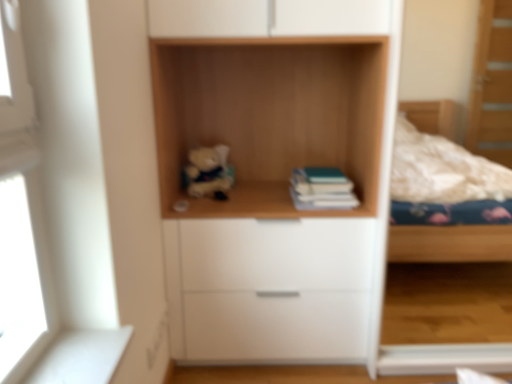
Measure the distance between white matte drawer at center and camera.

white matte drawer at center is 1.60 meters from camera.

The image size is (512, 384). Describe the element at coordinates (208, 172) in the screenshot. I see `soft plush bear at center` at that location.

What do you see at coordinates (270, 117) in the screenshot?
I see `wooden shelf at center` at bounding box center [270, 117].

This screenshot has width=512, height=384. Describe the element at coordinates (322, 189) in the screenshot. I see `teal matte book at center` at that location.

Identify the location of white matte drawer at center. (275, 289).

Is teal matte book at center wider or thinner than wooden shelf at center?

Clearly, teal matte book at center has less width compared to wooden shelf at center.

From the image's perspective, does teal matte book at center appear lower than wooden shelf at center?

Yes, from the image's perspective, teal matte book at center is below wooden shelf at center.

From the image's perspective, which one is positioned higher, wooden shelf at center or white matte drawer at center?

wooden shelf at center appears higher in the image.

Looking at their sizes, would you say wooden shelf at center is wider or thinner than white matte drawer at center?

wooden shelf at center is thinner than white matte drawer at center.

Does point (314, 67) appear closer or farther from the camera than point (192, 337)?

Point (314, 67).

How different are the orientations of wooden shelf at center and white matte drawer at center in degrees?

There is a 0.922-degree angle between the facing directions of wooden shelf at center and white matte drawer at center.

Is teal matte book at center at the back of wooden shelf at center?

No, wooden shelf at center is not facing away from teal matte book at center.

Is wooden shelf at center shorter than teal matte book at center?

In fact, wooden shelf at center may be taller than teal matte book at center.

Which object is wider, wooden shelf at center or teal matte book at center?

Wider between the two is wooden shelf at center.

Considering the relative sizes of wooden shelf at center and teal matte book at center in the image provided, is wooden shelf at center bigger than teal matte book at center?

Correct, wooden shelf at center is larger in size than teal matte book at center.

Can you tell me how much wooden shelf at center and soft plush bear at center differ in facing direction?

The angular difference between wooden shelf at center and soft plush bear at center is 42.2 degrees.

Would you say wooden shelf at center is inside or outside soft plush bear at center?

wooden shelf at center exists outside the volume of soft plush bear at center.

Considering the positions of objects wooden shelf at center and soft plush bear at center in the image provided, who is behind, wooden shelf at center or soft plush bear at center?

Positioned behind is soft plush bear at center.

Which is more to the left, wooden shelf at center or soft plush bear at center?

soft plush bear at center.

Can you tell me how much teal matte book at center and soft plush bear at center differ in facing direction?

40.4 degrees separate the facing orientations of teal matte book at center and soft plush bear at center.

Is teal matte book at center closer to the viewer compared to soft plush bear at center?

Yes, teal matte book at center is closer to the camera.

In the image, is teal matte book at center on the left side or the right side of soft plush bear at center?

From the image, it's evident that teal matte book at center is to the right of soft plush bear at center.

From a real-world perspective, is soft plush bear at center positioned under white matte drawer at center based on gravity?

No, from a real-world perspective, soft plush bear at center is not beneath white matte drawer at center.

Can you confirm if soft plush bear at center is shorter than white matte drawer at center?

Yes, soft plush bear at center is shorter than white matte drawer at center.

At what (x,y) coordinates should I click in order to perform the action: click on toy behind the white matte drawer at center. Please return your answer as a coordinate pair (x, y). Image resolution: width=512 pixels, height=384 pixels. Looking at the image, I should click on (208, 172).

Is point (190, 189) in front of point (304, 255)?

No, it is not.

From the image's perspective, which one is positioned lower, white matte drawer at center or wooden shelf at center?

white matte drawer at center, from the image's perspective.

Considering the positions of point (337, 240) and point (258, 69), is point (337, 240) closer or farther from the camera than point (258, 69)?

Point (337, 240) is positioned closer to the camera compared to point (258, 69).

Do you think white matte drawer at center is within wooden shelf at center, or outside of it?

white matte drawer at center cannot be found inside wooden shelf at center.

Which object is positioned more to the left, white matte drawer at center or wooden shelf at center?

From the viewer's perspective, wooden shelf at center appears more on the left side.

Where is `paperback book that is on the right side of wooden shelf at center`? This screenshot has width=512, height=384. paperback book that is on the right side of wooden shelf at center is located at coordinates (322, 189).

The width and height of the screenshot is (512, 384). What are the coordinates of `shelf that is in front of the white matte drawer at center` in the screenshot? It's located at 270,117.

When comparing their distances from teal matte book at center, does white matte drawer at center or soft plush bear at center seem further?

The object further to teal matte book at center is soft plush bear at center.

From the image, which object appears to be farther from white matte drawer at center, soft plush bear at center or wooden shelf at center?

Among the two, soft plush bear at center is located further to white matte drawer at center.

Based on their spatial positions, is white matte drawer at center or wooden shelf at center closer to soft plush bear at center?

wooden shelf at center.

From the image, which object appears to be farther from soft plush bear at center, teal matte book at center or white matte drawer at center?

Among the two, white matte drawer at center is located further to soft plush bear at center.

Which object lies nearer to the anchor point white matte drawer at center, soft plush bear at center or teal matte book at center?

teal matte book at center.

Which object lies nearer to the anchor point white matte drawer at center, wooden shelf at center or soft plush bear at center?

The object closer to white matte drawer at center is wooden shelf at center.

When comparing their distances from wooden shelf at center, does soft plush bear at center or white matte drawer at center seem further?

Among the two, white matte drawer at center is located further to wooden shelf at center.

Based on their spatial positions, is white matte drawer at center or teal matte book at center closer to soft plush bear at center?

teal matte book at center.

What are the coordinates of `drawer between soft plush bear at center and teal matte book at center in the horizontal direction` in the screenshot? It's located at (275, 289).

Where is `shelf between soft plush bear at center and teal matte book at center in the horizontal direction`? This screenshot has width=512, height=384. shelf between soft plush bear at center and teal matte book at center in the horizontal direction is located at coordinates (270, 117).

Locate an element on the screen. paperback book that lies between wooden shelf at center and white matte drawer at center from top to bottom is located at coordinates (322, 189).

Identify the location of toy between wooden shelf at center and white matte drawer at center in the vertical direction. (208, 172).